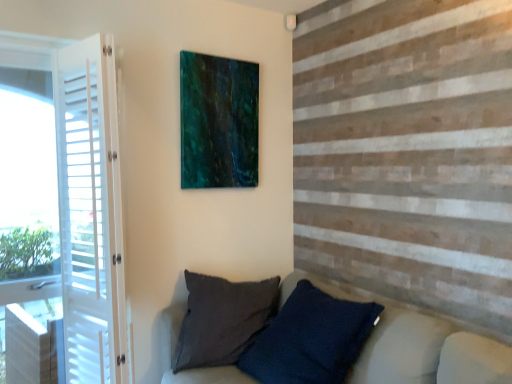
Question: From a real-world perspective, is white wood screen door at left above or below dark blue textured pillow at lower center?

Choices:
 (A) above
 (B) below

Answer: (A)

Question: Is white wood screen door at left to the left or to the right of dark blue textured pillow at lower center in the image?

Choices:
 (A) left
 (B) right

Answer: (A)

Question: Which is farther from the teal glossy painting at upper center?

Choices:
 (A) white wood screen door at left
 (B) dark blue textured pillow at lower center

Answer: (B)

Question: Estimate the real-world distances between objects in this image. Which object is farther from the white wood screen door at left?

Choices:
 (A) dark blue textured pillow at lower center
 (B) teal glossy painting at upper center

Answer: (A)